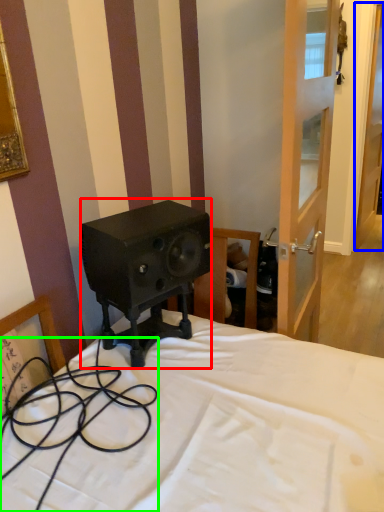
Question: Based on their relative distances, which object is nearer to loudspeaker (highlighted by a red box)? Choose from door (highlighted by a blue box) and cable (highlighted by a green box).

Choices:
 (A) door
 (B) cable

Answer: (B)